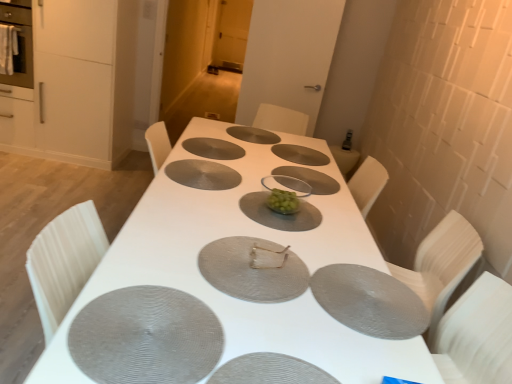
Identify the location of vacant space in between gray textured placemat at lower right, which is the third pizza pan from front to back, and green matte platter at center. The image size is (512, 384). (322, 238).